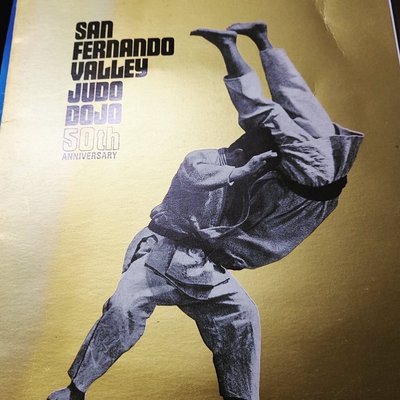
Where is `light glare`? This screenshot has width=400, height=400. light glare is located at coordinates (40, 161).